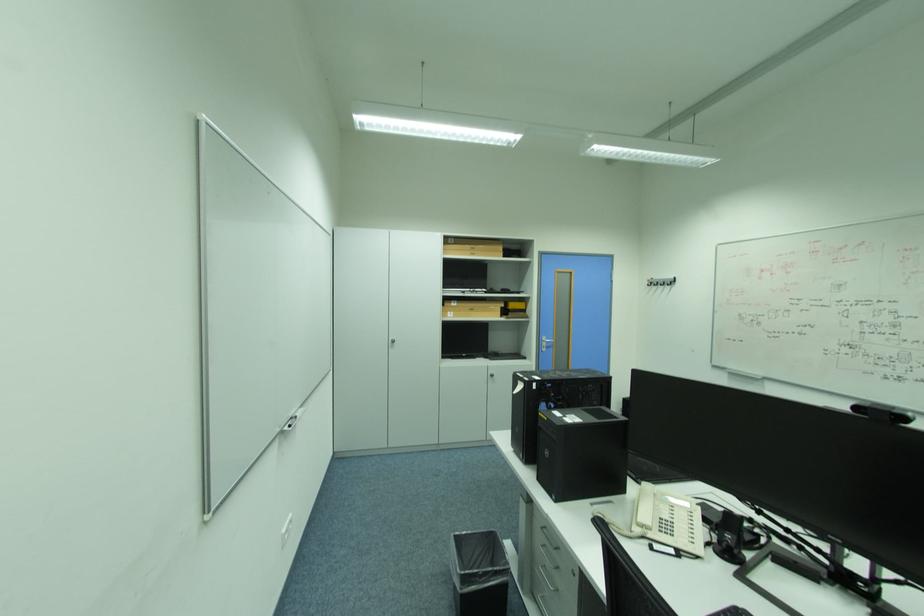
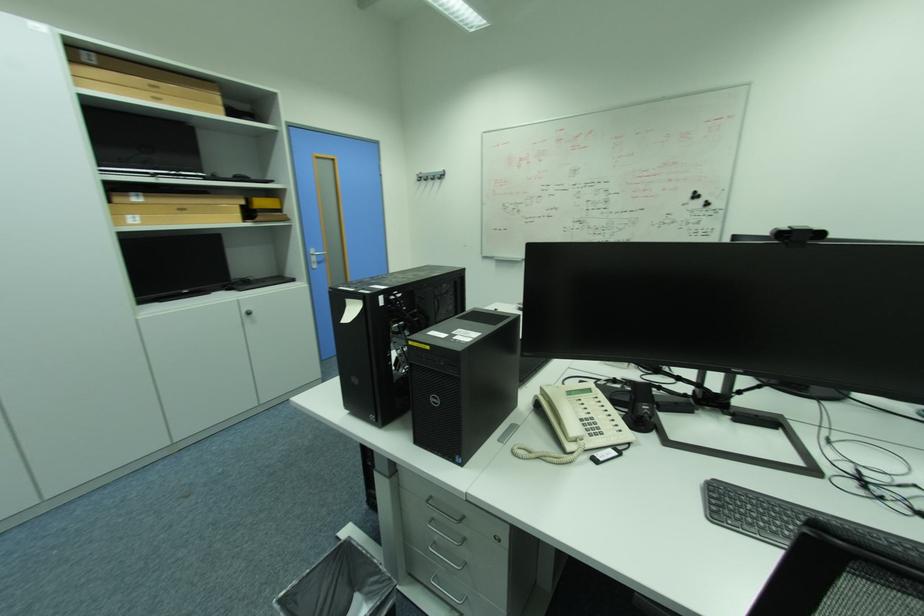
Find the pixel in the second image that matches (653,283) in the first image.

(421, 179)